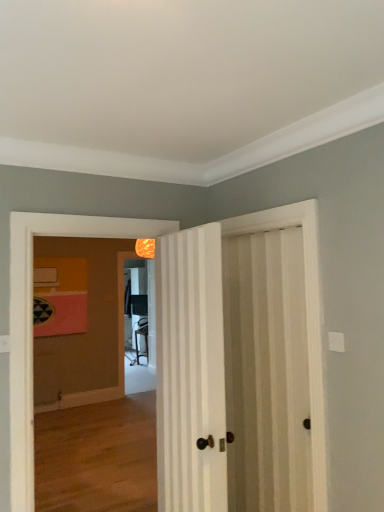
Question: Could you tell me if matte black screen door at center is turned towards white striped door at center, the second door in the right-to-left sequence?

Choices:
 (A) no
 (B) yes

Answer: (A)

Question: Is matte black screen door at center looking in the opposite direction of white striped door at center, marked as the 1th door in a left-to-right arrangement?

Choices:
 (A) yes
 (B) no

Answer: (B)

Question: Can you confirm if matte black screen door at center is shorter than white striped door at center, the second door in the right-to-left sequence?

Choices:
 (A) yes
 (B) no

Answer: (B)

Question: Is matte black screen door at center to the left of white striped door at center, marked as the 1th door in a left-to-right arrangement, from the viewer's perspective?

Choices:
 (A) yes
 (B) no

Answer: (A)

Question: Can you confirm if matte black screen door at center is smaller than white striped door at center, marked as the 1th door in a left-to-right arrangement?

Choices:
 (A) yes
 (B) no

Answer: (A)

Question: From the image's perspective, would you say matte black screen door at center is positioned over white striped door at center, the second door in the right-to-left sequence?

Choices:
 (A) no
 (B) yes

Answer: (A)

Question: Does white striped door at center, the second door in the right-to-left sequence, have a smaller size compared to white striped door at right, acting as the second door starting from the left?

Choices:
 (A) yes
 (B) no

Answer: (B)

Question: From the image's perspective, would you say white striped door at center, the second door in the right-to-left sequence, is positioned over white striped door at right, acting as the second door starting from the left?

Choices:
 (A) yes
 (B) no

Answer: (A)

Question: Is white striped door at center, the second door in the right-to-left sequence, at the left side of white striped door at right, arranged as the first door when viewed from the right?

Choices:
 (A) no
 (B) yes

Answer: (B)

Question: From a real-world perspective, is white striped door at center, marked as the 1th door in a left-to-right arrangement, on top of white striped door at right, arranged as the first door when viewed from the right?

Choices:
 (A) yes
 (B) no

Answer: (A)

Question: Is white striped door at center, the second door in the right-to-left sequence, behind white striped door at right, arranged as the first door when viewed from the right?

Choices:
 (A) no
 (B) yes

Answer: (A)

Question: Does white striped door at center, marked as the 1th door in a left-to-right arrangement, have a greater height compared to white striped door at right, acting as the second door starting from the left?

Choices:
 (A) yes
 (B) no

Answer: (B)

Question: From the image's perspective, is white striped door at right, acting as the second door starting from the left, under matte black screen door at center?

Choices:
 (A) yes
 (B) no

Answer: (B)